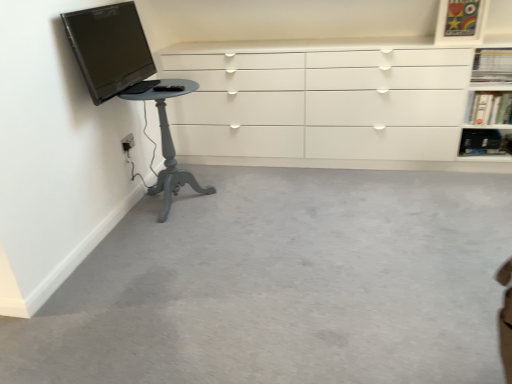
The height and width of the screenshot is (384, 512). What do you see at coordinates (492, 65) in the screenshot?
I see `white glossy bookshelf at upper right, acting as the 3th shelf starting from the bottom` at bounding box center [492, 65].

Identify the location of white plastic electric outlet at lower left. (128, 142).

The height and width of the screenshot is (384, 512). Describe the element at coordinates (489, 108) in the screenshot. I see `white glossy bookshelf at upper right, the 2th shelf positioned from the bottom` at that location.

What are the coordinates of `white glossy chest of drawers at upper center` in the screenshot? It's located at (323, 106).

Where is `black plastic shelf at upper right, placed as the third shelf when sorted from top to bottom`? black plastic shelf at upper right, placed as the third shelf when sorted from top to bottom is located at coordinates (482, 142).

Locate an element on the screen. This screenshot has height=384, width=512. white glossy bookshelf at upper right, acting as the 3th shelf starting from the bottom is located at coordinates (492, 65).

Which is behind, white plastic electric outlet at lower left or white glossy bookshelf at upper right, the 1th shelf viewed from the top?

white glossy bookshelf at upper right, the 1th shelf viewed from the top, is more distant.

Considering the relative positions of white plastic electric outlet at lower left and white glossy bookshelf at upper right, the 1th shelf viewed from the top, in the image provided, is white plastic electric outlet at lower left to the left of white glossy bookshelf at upper right, the 1th shelf viewed from the top, from the viewer's perspective?

Yes, white plastic electric outlet at lower left is to the left of white glossy bookshelf at upper right, the 1th shelf viewed from the top.

Is white plastic electric outlet at lower left facing away from white glossy bookshelf at upper right, acting as the 3th shelf starting from the bottom?

white plastic electric outlet at lower left is not turned away from white glossy bookshelf at upper right, acting as the 3th shelf starting from the bottom.

Is white plastic electric outlet at lower left placed right next to white glossy bookshelf at upper right, the 1th shelf viewed from the top?

No, white plastic electric outlet at lower left is not touching white glossy bookshelf at upper right, the 1th shelf viewed from the top.

Is the surface of white glossy bookshelf at upper right, the 2th shelf positioned from the bottom, in direct contact with black plastic shelf at upper right, the first shelf positioned from the bottom?

white glossy bookshelf at upper right, the 2th shelf positioned from the bottom, is not next to black plastic shelf at upper right, the first shelf positioned from the bottom, and they're not touching.

Between white glossy bookshelf at upper right, which is counted as the second shelf, starting from the top, and black plastic shelf at upper right, the first shelf positioned from the bottom, which one has larger size?

Bigger between the two is white glossy bookshelf at upper right, which is counted as the second shelf, starting from the top.

Is white glossy bookshelf at upper right, which is counted as the second shelf, starting from the top, oriented away from black plastic shelf at upper right, placed as the third shelf when sorted from top to bottom?

white glossy bookshelf at upper right, which is counted as the second shelf, starting from the top, does not have its back to black plastic shelf at upper right, placed as the third shelf when sorted from top to bottom.

Between white glossy bookshelf at upper right, which is counted as the second shelf, starting from the top, and black plastic shelf at upper right, the first shelf positioned from the bottom, which one has smaller width?

Thinner between the two is white glossy bookshelf at upper right, which is counted as the second shelf, starting from the top.

Is white glossy chest of drawers at upper center spatially inside white glossy bookshelf at upper right, acting as the 3th shelf starting from the bottom, or outside of it?

white glossy chest of drawers at upper center is located beyond the bounds of white glossy bookshelf at upper right, acting as the 3th shelf starting from the bottom.

How different are the orientations of white glossy chest of drawers at upper center and white glossy bookshelf at upper right, the 1th shelf viewed from the top, in degrees?

0.297 degrees.

How much distance is there between white glossy chest of drawers at upper center and white glossy bookshelf at upper right, acting as the 3th shelf starting from the bottom?

A distance of 34.38 inches exists between white glossy chest of drawers at upper center and white glossy bookshelf at upper right, acting as the 3th shelf starting from the bottom.

Is point (265, 152) in front of point (502, 77)?

No, (265, 152) is behind (502, 77).

From the image's perspective, is white glossy chest of drawers at upper center on white glossy bookshelf at upper right, the 2th shelf positioned from the bottom?

Indeed, from the image's perspective, white glossy chest of drawers at upper center is shown above white glossy bookshelf at upper right, the 2th shelf positioned from the bottom.

Considering the sizes of objects white glossy chest of drawers at upper center and white glossy bookshelf at upper right, which is counted as the second shelf, starting from the top, in the image provided, who is shorter, white glossy chest of drawers at upper center or white glossy bookshelf at upper right, which is counted as the second shelf, starting from the top,?

With less height is white glossy bookshelf at upper right, which is counted as the second shelf, starting from the top.

Is white glossy chest of drawers at upper center facing towards white glossy bookshelf at upper right, which is counted as the second shelf, starting from the top?

Yes, white glossy chest of drawers at upper center faces towards white glossy bookshelf at upper right, which is counted as the second shelf, starting from the top.

Do you think white glossy chest of drawers at upper center is within white glossy bookshelf at upper right, the 2th shelf positioned from the bottom, or outside of it?

The correct answer is: outside.

Is the depth of black plastic shelf at upper right, the first shelf positioned from the bottom, greater than that of white glossy bookshelf at upper right, acting as the 3th shelf starting from the bottom?

Yes, the depth of black plastic shelf at upper right, the first shelf positioned from the bottom, is greater than that of white glossy bookshelf at upper right, acting as the 3th shelf starting from the bottom.

From a real-world perspective, is black plastic shelf at upper right, placed as the third shelf when sorted from top to bottom, over white glossy bookshelf at upper right, the 1th shelf viewed from the top?

No.

Considering the relative sizes of black plastic shelf at upper right, placed as the third shelf when sorted from top to bottom, and white glossy bookshelf at upper right, acting as the 3th shelf starting from the bottom, in the image provided, is black plastic shelf at upper right, placed as the third shelf when sorted from top to bottom, thinner than white glossy bookshelf at upper right, acting as the 3th shelf starting from the bottom,?

Yes.

Is black plastic shelf at upper right, the first shelf positioned from the bottom, far from white glossy bookshelf at upper right, acting as the 3th shelf starting from the bottom?

No, black plastic shelf at upper right, the first shelf positioned from the bottom, is in close proximity to white glossy bookshelf at upper right, acting as the 3th shelf starting from the bottom.

The width and height of the screenshot is (512, 384). In the image, there is a white glossy bookshelf at upper right, which is counted as the second shelf, starting from the top. Identify the location of shelf above it (from the image's perspective). click(x=492, y=65).

Is white glossy bookshelf at upper right, the 1th shelf viewed from the top, at the back of white glossy bookshelf at upper right, the 2th shelf positioned from the bottom?

No, white glossy bookshelf at upper right, the 2th shelf positioned from the bottom,'s orientation is not away from white glossy bookshelf at upper right, the 1th shelf viewed from the top.

From the image's perspective, is white glossy bookshelf at upper right, which is counted as the second shelf, starting from the top, located beneath white glossy bookshelf at upper right, acting as the 3th shelf starting from the bottom?

Correct, white glossy bookshelf at upper right, which is counted as the second shelf, starting from the top, appears lower than white glossy bookshelf at upper right, acting as the 3th shelf starting from the bottom, in the image.

Is matte black tv at upper left spatially inside matte gray pedestal table at left, or outside of it?

matte black tv at upper left cannot be found inside matte gray pedestal table at left.

From a real-world perspective, which object stands above the other?

matte black tv at upper left, from a real-world perspective.

What's the angular difference between matte black tv at upper left and matte gray pedestal table at left's facing directions?

They differ by 0.119 degrees in their facing directions.

The width and height of the screenshot is (512, 384). I want to click on television above the matte gray pedestal table at left (from the image's perspective), so click(109, 48).

At what (x,y) coordinates should I click in order to perform the action: click on electric outlet on the left of white glossy bookshelf at upper right, the 1th shelf viewed from the top. Please return your answer as a coordinate pair (x, y). The height and width of the screenshot is (384, 512). Looking at the image, I should click on (128, 142).

From the image's perspective, which shelf is the 1st one above the black plastic shelf at upper right, placed as the third shelf when sorted from top to bottom? Please provide its 2D coordinates.

[(489, 108)]

Which object lies nearer to the anchor point matte gray pedestal table at left, white plastic electric outlet at lower left or white glossy bookshelf at upper right, acting as the 3th shelf starting from the bottom?

white plastic electric outlet at lower left.

Looking at the image, which one is located further to black plastic shelf at upper right, placed as the third shelf when sorted from top to bottom, white plastic electric outlet at lower left or white glossy bookshelf at upper right, acting as the 3th shelf starting from the bottom?

white plastic electric outlet at lower left lies further to black plastic shelf at upper right, placed as the third shelf when sorted from top to bottom, than the other object.

Based on their spatial positions, is black plastic shelf at upper right, the first shelf positioned from the bottom, or white glossy bookshelf at upper right, the 2th shelf positioned from the bottom, further from white glossy bookshelf at upper right, acting as the 3th shelf starting from the bottom?

The object further to white glossy bookshelf at upper right, acting as the 3th shelf starting from the bottom, is black plastic shelf at upper right, the first shelf positioned from the bottom.

When comparing their distances from white plastic electric outlet at lower left, does matte gray pedestal table at left or black plastic shelf at upper right, the first shelf positioned from the bottom, seem closer?

Among the two, matte gray pedestal table at left is located nearer to white plastic electric outlet at lower left.

From the image, which object appears to be nearer to white glossy bookshelf at upper right, the 2th shelf positioned from the bottom, white plastic electric outlet at lower left or black plastic shelf at upper right, placed as the third shelf when sorted from top to bottom?

Among the two, black plastic shelf at upper right, placed as the third shelf when sorted from top to bottom, is located nearer to white glossy bookshelf at upper right, the 2th shelf positioned from the bottom.

From the image, which object appears to be nearer to white plastic electric outlet at lower left, black plastic shelf at upper right, the first shelf positioned from the bottom, or white glossy bookshelf at upper right, the 1th shelf viewed from the top?

The object closer to white plastic electric outlet at lower left is white glossy bookshelf at upper right, the 1th shelf viewed from the top.

Estimate the real-world distances between objects in this image. Which object is further from white glossy bookshelf at upper right, the 2th shelf positioned from the bottom, white glossy chest of drawers at upper center or black plastic shelf at upper right, the first shelf positioned from the bottom?

Among the two, white glossy chest of drawers at upper center is located further to white glossy bookshelf at upper right, the 2th shelf positioned from the bottom.

Looking at the image, which one is located further to white glossy bookshelf at upper right, which is counted as the second shelf, starting from the top, white glossy chest of drawers at upper center or white glossy bookshelf at upper right, acting as the 3th shelf starting from the bottom?

white glossy chest of drawers at upper center lies further to white glossy bookshelf at upper right, which is counted as the second shelf, starting from the top, than the other object.

At what (x,y) coordinates should I click in order to perform the action: click on furniture between matte black tv at upper left and white glossy chest of drawers at upper center in the horizontal direction. Please return your answer as a coordinate pair (x, y). The image size is (512, 384). Looking at the image, I should click on (169, 146).

Identify the location of the chest of drawers located between matte black tv at upper left and white glossy bookshelf at upper right, the 1th shelf viewed from the top, in the left-right direction. (323, 106).

Where is `chest of drawers between matte gray pedestal table at left and white glossy bookshelf at upper right, the 2th shelf positioned from the bottom`? The image size is (512, 384). chest of drawers between matte gray pedestal table at left and white glossy bookshelf at upper right, the 2th shelf positioned from the bottom is located at coordinates 323,106.

At what (x,y) coordinates should I click in order to perform the action: click on chest of drawers between white plastic electric outlet at lower left and black plastic shelf at upper right, placed as the third shelf when sorted from top to bottom. Please return your answer as a coordinate pair (x, y). The height and width of the screenshot is (384, 512). Looking at the image, I should click on (323, 106).